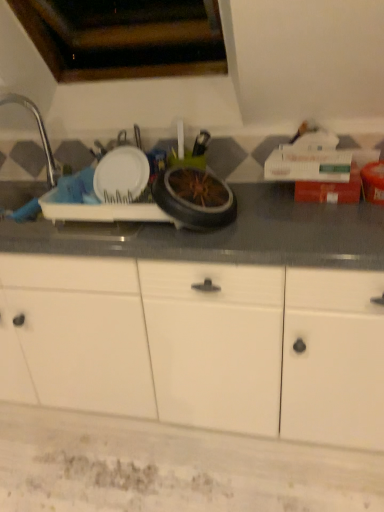
Question: Is white matte cabinet at center surrounded by silver metallic faucet at left?

Choices:
 (A) no
 (B) yes

Answer: (A)

Question: Is silver metallic faucet at left further to the viewer compared to white matte cabinet at center?

Choices:
 (A) yes
 (B) no

Answer: (A)

Question: Is silver metallic faucet at left wider than white matte cabinet at center?

Choices:
 (A) yes
 (B) no

Answer: (B)

Question: Is silver metallic faucet at left in contact with white matte cabinet at center?

Choices:
 (A) yes
 (B) no

Answer: (B)

Question: Is silver metallic faucet at left not close to white matte cabinet at center?

Choices:
 (A) no
 (B) yes

Answer: (A)

Question: Is silver metallic faucet at left outside white matte cabinet at center?

Choices:
 (A) no
 (B) yes

Answer: (B)

Question: Can we say white matte cabinet at center lies outside silver metallic faucet at left?

Choices:
 (A) no
 (B) yes

Answer: (B)

Question: Does white matte cabinet at center have a greater width compared to silver metallic faucet at left?

Choices:
 (A) yes
 (B) no

Answer: (A)

Question: Would you say white matte cabinet at center is a long distance from silver metallic faucet at left?

Choices:
 (A) no
 (B) yes

Answer: (A)

Question: Is white matte cabinet at center oriented away from silver metallic faucet at left?

Choices:
 (A) yes
 (B) no

Answer: (B)

Question: From a real-world perspective, is white matte cabinet at center positioned over silver metallic faucet at left based on gravity?

Choices:
 (A) yes
 (B) no

Answer: (B)

Question: Is white matte cabinet at center to the left of silver metallic faucet at left from the viewer's perspective?

Choices:
 (A) no
 (B) yes

Answer: (A)

Question: Considering the positions of white matte cabinet at center and silver metallic faucet at left in the image, is white matte cabinet at center taller or shorter than silver metallic faucet at left?

Choices:
 (A) short
 (B) tall

Answer: (B)